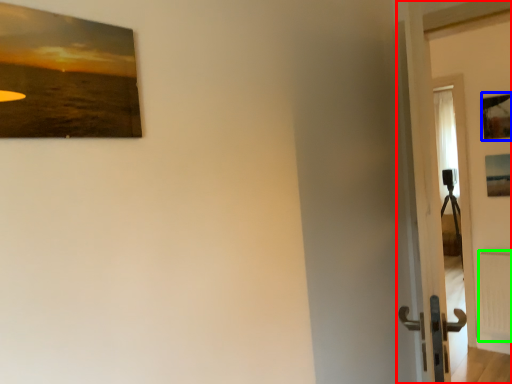
Question: Which is farther away from door (highlighted by a red box)? picture frame (highlighted by a blue box) or radiator (highlighted by a green box)?

Choices:
 (A) picture frame
 (B) radiator

Answer: (A)